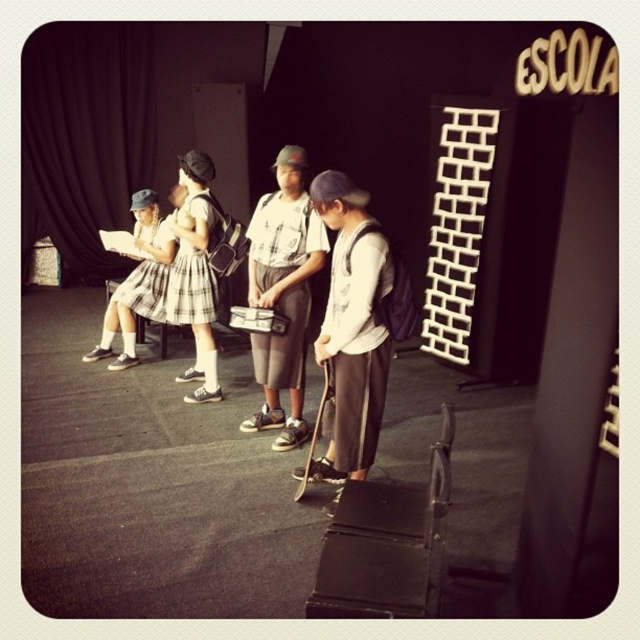
You are a photographer trying to capture a group shot of the matte white shirt at center and plaid skirt at left. The camera you are using has a minimum focusing distance of 1 meter. Can you take a clear photo of both subjects without moving either of them?

The matte white shirt at center and plaid skirt at left are 1.26 meters apart. Since the distance between them is greater than the camera minimum focusing distance of 1 meter, you can take a clear photo of both subjects without moving them.

You are a photographer trying to capture a group photo of the children. You notice the white matte shirt at center and the plaid skirt at left. Which child should you adjust to ensure both are equally visible in the photo?

The white matte shirt at center occupies less space than plaid skirt at left, so you should adjust the white matte shirt at center to move closer to the camera or spread out to balance their visibility.